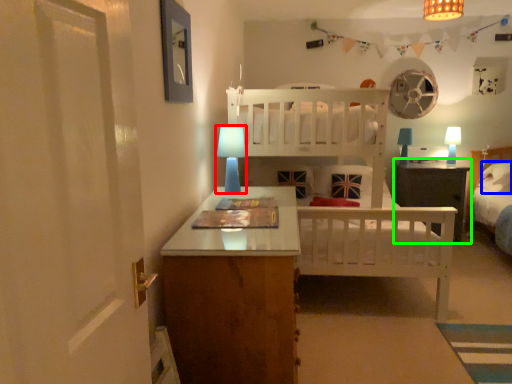
Question: Which object is positioned farthest from table lamp (highlighted by a red box)? Select from pillow (highlighted by a blue box) and nightstand (highlighted by a green box).

Choices:
 (A) pillow
 (B) nightstand

Answer: (A)